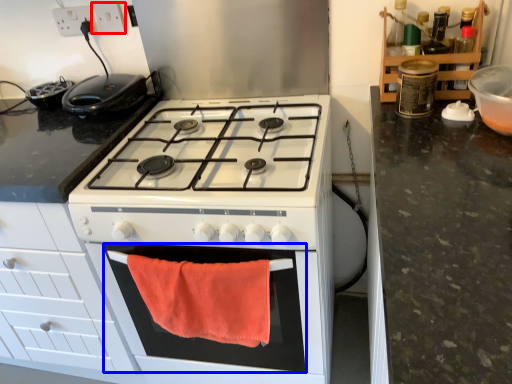
Question: Which point is closer to the camera, electric outlet (highlighted by a red box) or oven (highlighted by a blue box)?

Choices:
 (A) electric outlet
 (B) oven

Answer: (B)